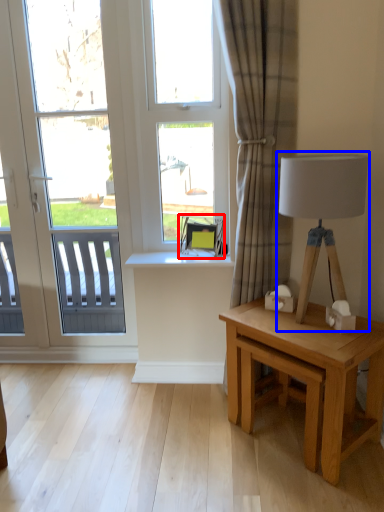
Question: Which point is further to the camera, swivel chair (highlighted by a red box) or table lamp (highlighted by a blue box)?

Choices:
 (A) swivel chair
 (B) table lamp

Answer: (A)